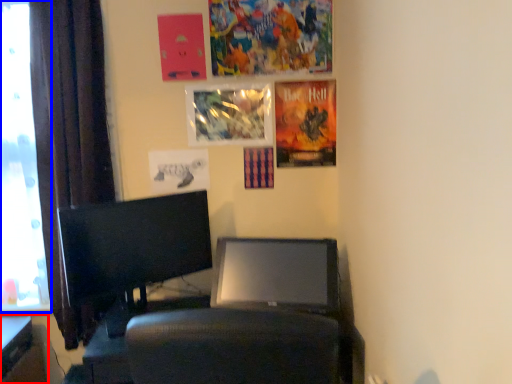
Question: Among these objects, which one is farthest to the camera, furniture (highlighted by a red box) or window screen (highlighted by a blue box)?

Choices:
 (A) furniture
 (B) window screen

Answer: (B)